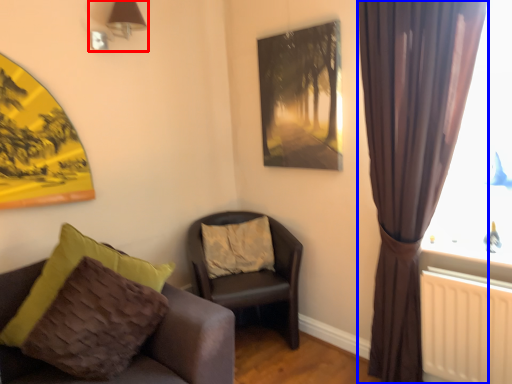
Question: Which of the following is the closest to the observer, lamp (highlighted by a red box) or curtain (highlighted by a blue box)?

Choices:
 (A) lamp
 (B) curtain

Answer: (B)